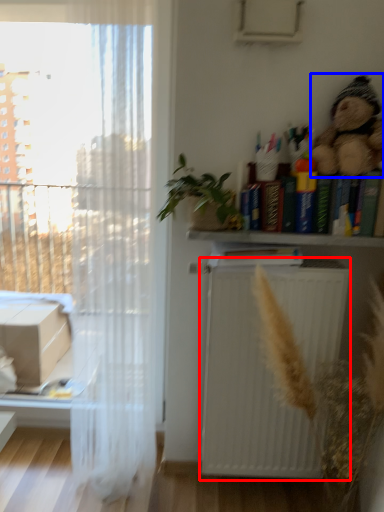
Question: Which point is further to the camera, radiator (highlighted by a red box) or toy (highlighted by a blue box)?

Choices:
 (A) radiator
 (B) toy

Answer: (A)